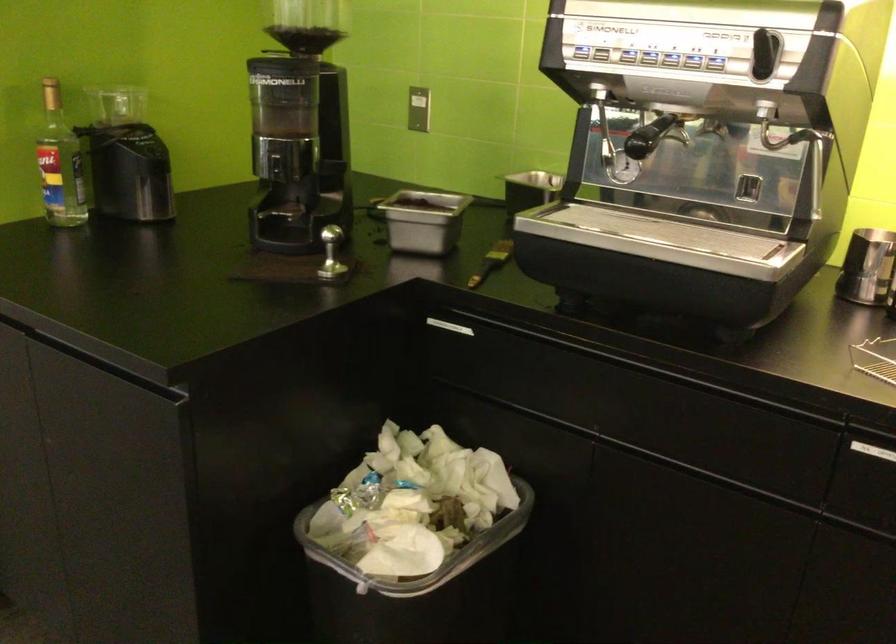
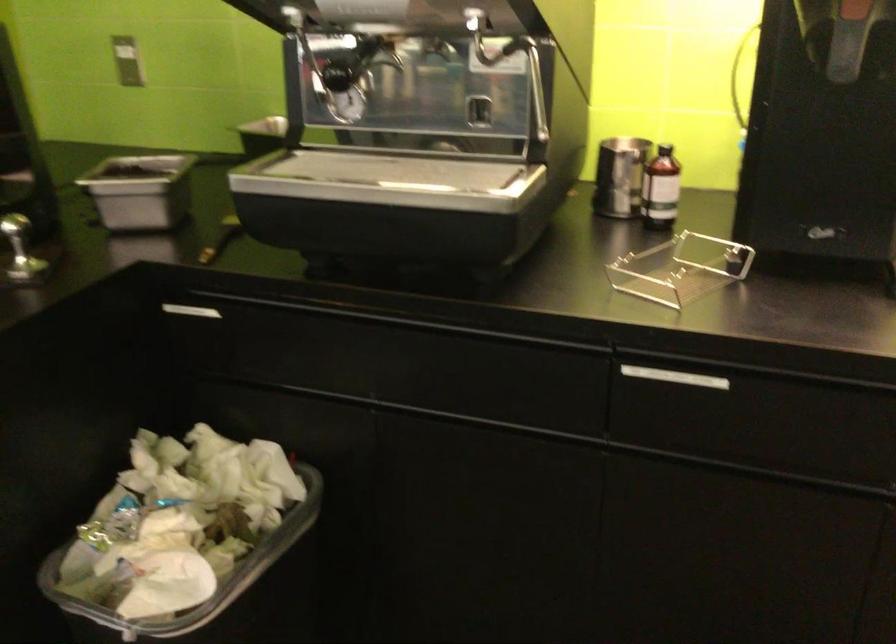
In the second image, find the point that corresponds to [437,571] in the first image.

(218, 592)